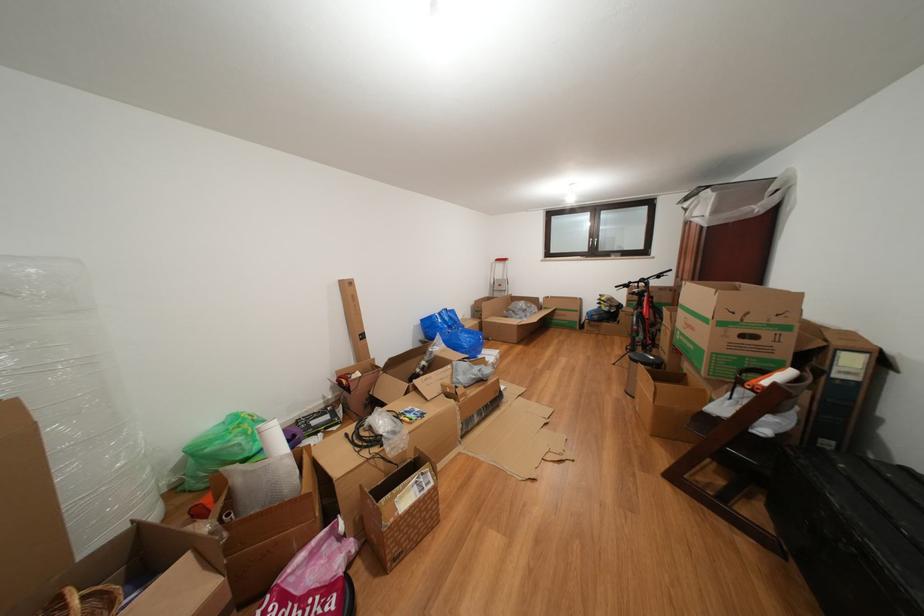
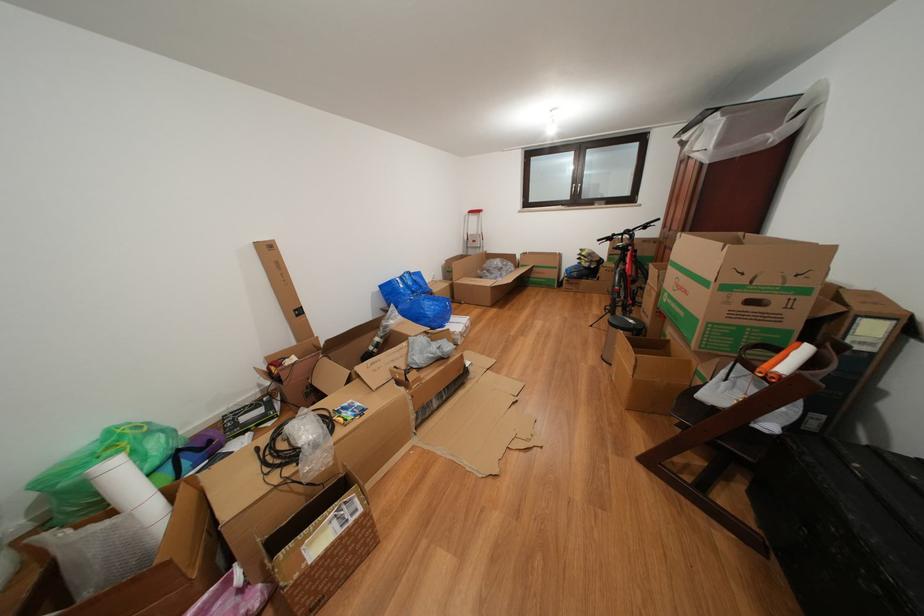
Question: Based on the continuous images, in which direction is the camera rotating? Reply with the corresponding letter.

Choices:
 (A) Left
 (B) Right
 (C) Up
 (D) Down

Answer: (D)